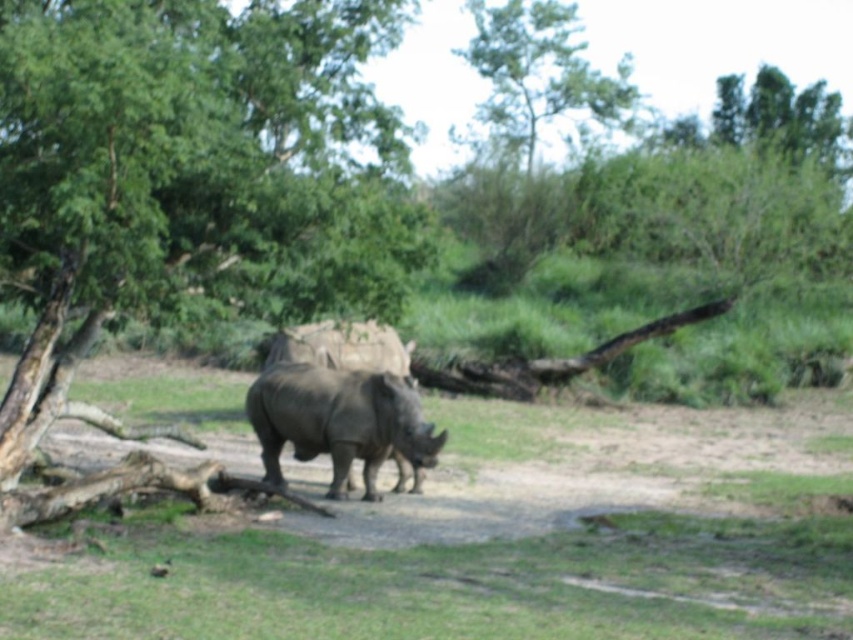
Question: Is green leafy tree at center bigger than gray matte rhinoceros at center?

Choices:
 (A) yes
 (B) no

Answer: (A)

Question: Can you confirm if green leafy tree at center is positioned to the left of gray matte rhinoceros at center?

Choices:
 (A) yes
 (B) no

Answer: (A)

Question: Is green leafy tree at center to the right of gray matte rhinoceros at center from the viewer's perspective?

Choices:
 (A) yes
 (B) no

Answer: (B)

Question: Which object appears farthest from the camera in this image?

Choices:
 (A) gray matte rhinoceros at center
 (B) green leafy tree at center

Answer: (A)

Question: Which of the following is the farthest from the observer?

Choices:
 (A) gray matte rhinoceros at center
 (B) green leafy tree at center

Answer: (A)